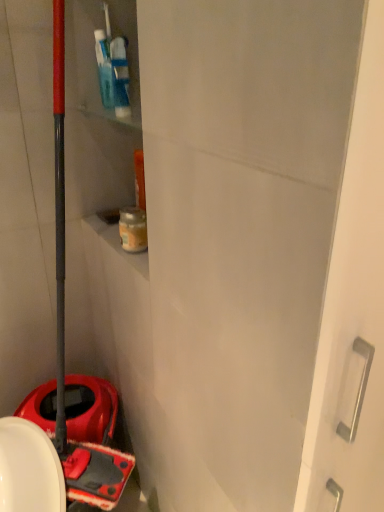
The image size is (384, 512). Describe the element at coordinates (95, 56) in the screenshot. I see `blue plastic shelf at upper left` at that location.

Measure the distance between blue plastic shelf at upper left and camera.

blue plastic shelf at upper left and camera are 3.37 feet apart.

Where is `blue plastic shelf at upper left`? The height and width of the screenshot is (512, 384). blue plastic shelf at upper left is located at coordinates (95, 56).

The width and height of the screenshot is (384, 512). Identify the location of blue plastic shelf at upper left. (95, 56).